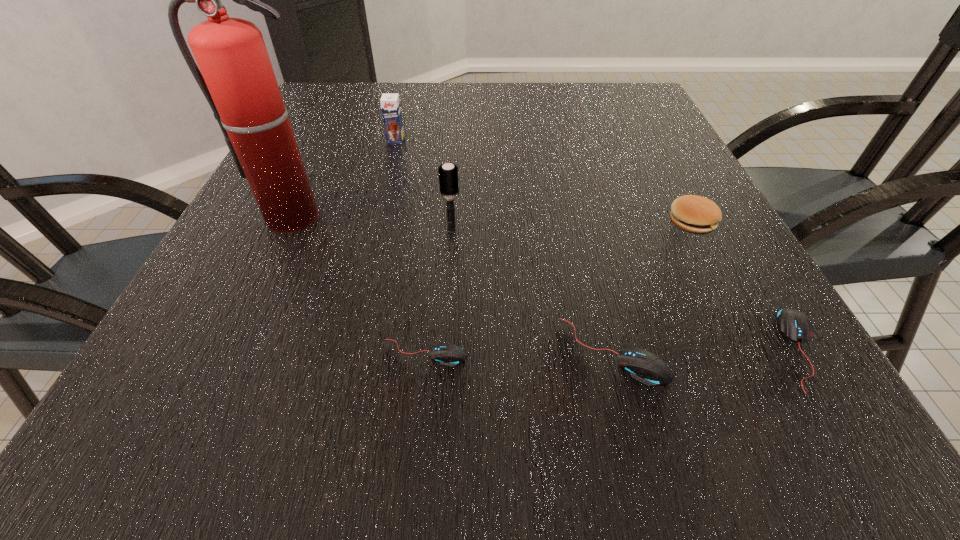
Identify the location of the second closest mouse relative to the leftmost mouse. (794, 325).

At what (x,y) coordinates should I click in order to perform the action: click on free space that satisfies the following two spatial constraints: 1. on the back side of the hairbrush; 2. on the left side of the fourth shortest object. Please return your answer as a coordinate pair (x, y). This screenshot has height=540, width=960. Looking at the image, I should click on (452, 222).

I want to click on vacant position in the image that satisfies the following two spatial constraints: 1. with the nozzle and gauge on the second shortest object; 2. on the right side of the leftmost object, so click(233, 349).

Locate an element on the screen. This screenshot has height=540, width=960. free spot that satisfies the following two spatial constraints: 1. with the nozzle and gauge on the fire extinguisher; 2. on the right side of the shortest mouse is located at coordinates (231, 353).

Where is `free space that satisfies the following two spatial constraints: 1. on the front label of the second shortest mouse; 2. on the left side of the farthest object`? free space that satisfies the following two spatial constraints: 1. on the front label of the second shortest mouse; 2. on the left side of the farthest object is located at coordinates (340, 349).

The width and height of the screenshot is (960, 540). Identify the location of free space that satisfies the following two spatial constraints: 1. on the front label of the sixth shortest object; 2. on the right side of the farthest object. (372, 230).

Where is `vacant space that satisfies the following two spatial constraints: 1. with the nozzle and gauge on the fire extinguisher; 2. on the right side of the patty`? Image resolution: width=960 pixels, height=540 pixels. vacant space that satisfies the following two spatial constraints: 1. with the nozzle and gauge on the fire extinguisher; 2. on the right side of the patty is located at coordinates (293, 222).

The width and height of the screenshot is (960, 540). What are the coordinates of `free space that satisfies the following two spatial constraints: 1. on the front label of the rightmost mouse; 2. on the left side of the farthest object` in the screenshot? It's located at (340, 349).

This screenshot has height=540, width=960. Identify the location of free space that satisfies the following two spatial constraints: 1. on the front label of the shortest object; 2. on the left side of the farthest object. (339, 353).